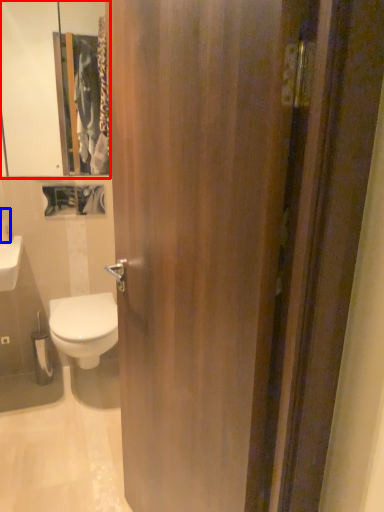
Question: Among these objects, which one is farthest to the camera, medicine cabinet (highlighted by a red box) or toiletry (highlighted by a blue box)?

Choices:
 (A) medicine cabinet
 (B) toiletry

Answer: (B)